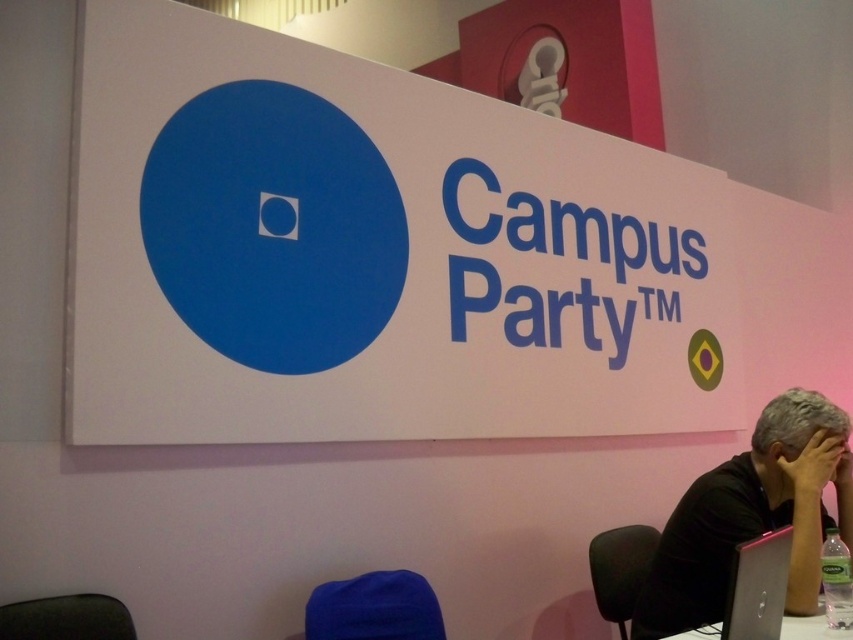
You are standing in the conference area and see the large signboard with the blue circle and the words Campus Party. There is also a point marked at coordinates [756,588]. What object is located at that point?

The point at coordinates [756,588] marks the silver metallic laptop at lower right.

You are organizing an event and need to place a 1.2 meter tall banner between the white matte sign at upper center and the silver metallic laptop at lower right. Which object should the banner be placed above to ensure it doesn

The white matte sign at upper center is much taller than the silver metallic laptop at lower right, so placing the banner above the white matte sign at upper center would ensure it is appropriately sized and positioned.

You are organizing an event and need to place a large banner that requires 2 meters of space. You see the white matte sign at upper center and the white plastic table at lower right. Which object has enough space for the banner?

The white matte sign at upper center is bigger than the white plastic table at lower right, so the banner can be placed there as it has sufficient space.